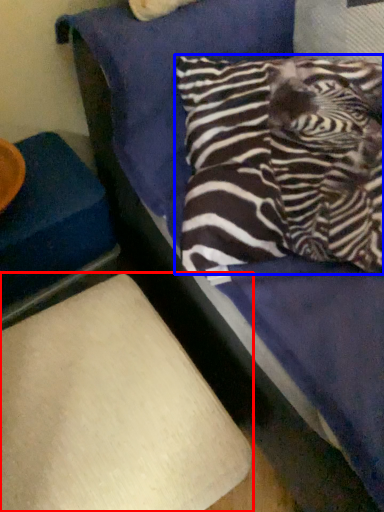
Question: Which object is further to the camera taking this photo, furniture (highlighted by a red box) or pillow (highlighted by a blue box)?

Choices:
 (A) furniture
 (B) pillow

Answer: (B)